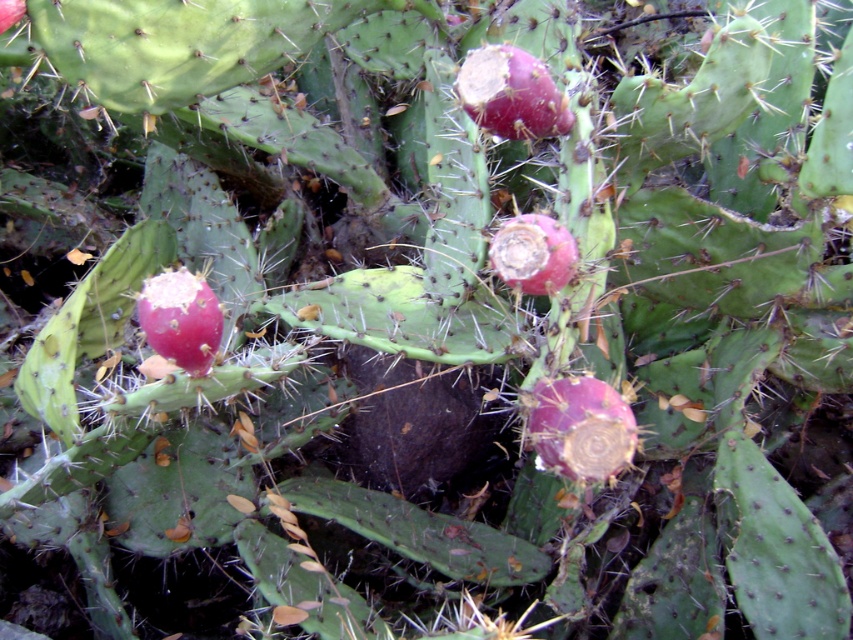
Question: Can you confirm if purple matte prickly pear cactus fruit at center is smaller than smooth red cactus fruit at center?

Choices:
 (A) yes
 (B) no

Answer: (B)

Question: Is purple matte prickly pear cactus fruit at center to the left of smooth red cactus fruit at center from the viewer's perspective?

Choices:
 (A) yes
 (B) no

Answer: (B)

Question: Which point appears closest to the camera in this image?

Choices:
 (A) (207, 337)
 (B) (494, 250)
 (C) (561, 426)
 (D) (526, 132)

Answer: (C)

Question: Which of the following is the closest to the observer?

Choices:
 (A) (521, 266)
 (B) (541, 449)
 (C) (192, 314)

Answer: (C)

Question: Among these points, which one is nearest to the camera?

Choices:
 (A) (544, 109)
 (B) (585, 410)
 (C) (548, 289)
 (D) (183, 282)

Answer: (B)

Question: Where is pink matte prickly pear cactus fruit at center located in relation to matte pink cactus fruit at center in the image?

Choices:
 (A) above
 (B) below

Answer: (A)